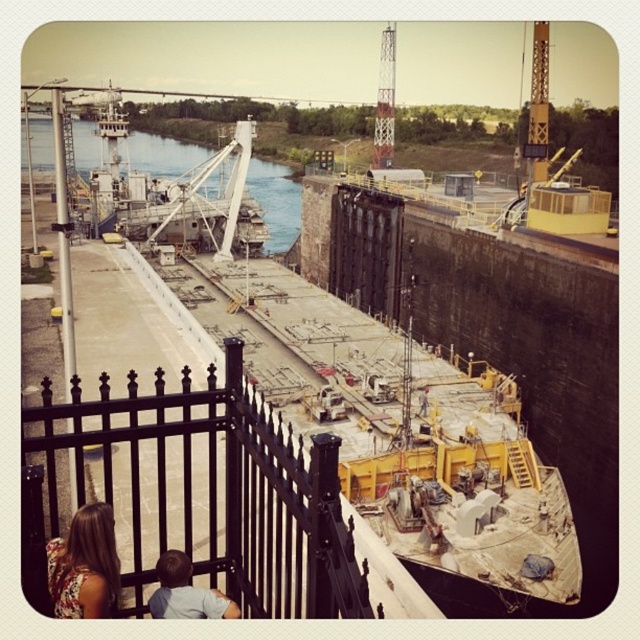
Between point (26, 566) and point (136, 170), which one is positioned in front?

Point (26, 566)

Does black wrought iron fence at lower left have a larger size compared to smooth concrete waterway at upper left?

No, black wrought iron fence at lower left is not bigger than smooth concrete waterway at upper left.

This screenshot has height=640, width=640. What do you see at coordinates (216, 492) in the screenshot?
I see `black wrought iron fence at lower left` at bounding box center [216, 492].

Where is `black wrought iron fence at lower left`? The image size is (640, 640). black wrought iron fence at lower left is located at coordinates (216, 492).

Is black wrought iron fence at lower left to the right of floral fabric dress at lower left from the viewer's perspective?

Indeed, black wrought iron fence at lower left is positioned on the right side of floral fabric dress at lower left.

At what (x,y) coordinates should I click in order to perform the action: click on black wrought iron fence at lower left. Please return your answer as a coordinate pair (x, y). The width and height of the screenshot is (640, 640). Looking at the image, I should click on (216, 492).

The height and width of the screenshot is (640, 640). Find the location of `black wrought iron fence at lower left`. black wrought iron fence at lower left is located at coordinates (216, 492).

Does point (186, 406) come in front of point (232, 618)?

No, it is not.

In the scene shown: Does black wrought iron fence at lower left appear on the left side of light brown hair at lower left?

Indeed, black wrought iron fence at lower left is positioned on the left side of light brown hair at lower left.

Is point (323, 525) more distant than point (218, 596)?

No, (323, 525) is closer to viewer.

Locate an element on the screen. black wrought iron fence at lower left is located at coordinates (216, 492).